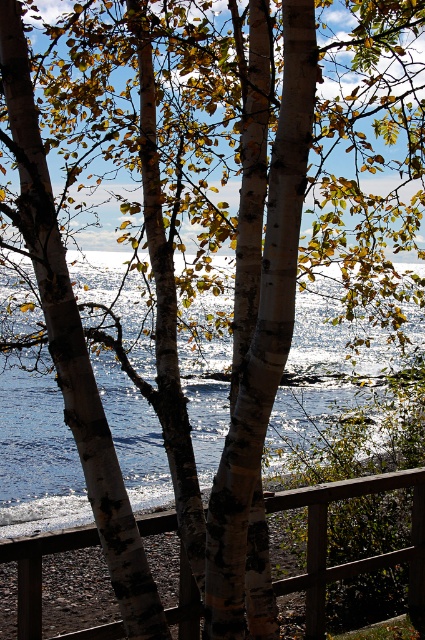
Is glistening water at center closer to the viewer compared to wooden at center?

No, glistening water at center is further to the viewer.

Is glistening water at center to the left of wooden at center from the viewer's perspective?

In fact, glistening water at center is to the right of wooden at center.

Is point (351, 369) positioned behind point (320, 589)?

Yes, point (351, 369) is farther from viewer.

Where is `glistening water at center`? This screenshot has width=425, height=640. glistening water at center is located at coordinates (36, 458).